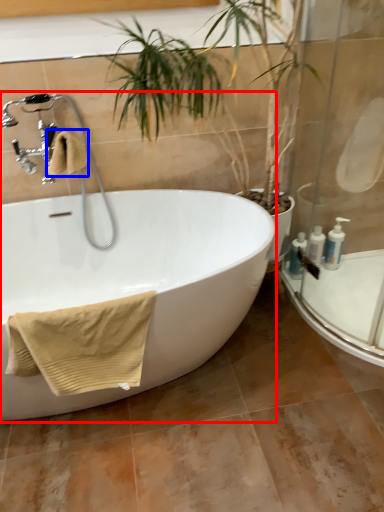
Question: Which of the following is the closest to the observer, bathtub (highlighted by a red box) or bath towel (highlighted by a blue box)?

Choices:
 (A) bathtub
 (B) bath towel

Answer: (A)